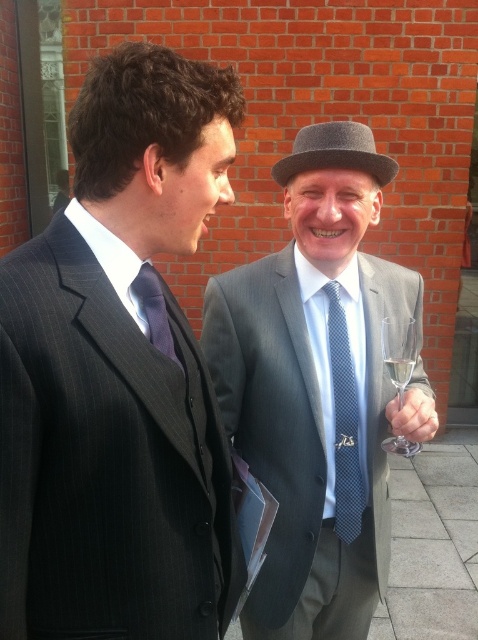
Question: Estimate the real-world distances between objects in this image. Which object is closer to the gray felt fedora at upper center?

Choices:
 (A) clear glass wine at right
 (B) purple satin tie at center
 (C) gray wool suit at center
 (D) blue dotted tie at center

Answer: (C)

Question: Is pinstriped suit at left wider than clear glass wine glass at right?

Choices:
 (A) yes
 (B) no

Answer: (A)

Question: Which object is closer to the camera taking this photo?

Choices:
 (A) clear glass wine glass at right
 (B) gray felt fedora at upper center
 (C) clear glass wine at right

Answer: (A)

Question: Is pinstriped suit at left in front of clear glass wine glass at right?

Choices:
 (A) no
 (B) yes

Answer: (B)

Question: Which point is closer to the camera?

Choices:
 (A) (397, 371)
 (B) (401, 435)

Answer: (A)

Question: Does pinstriped suit at left appear over gray felt fedora at upper center?

Choices:
 (A) yes
 (B) no

Answer: (B)